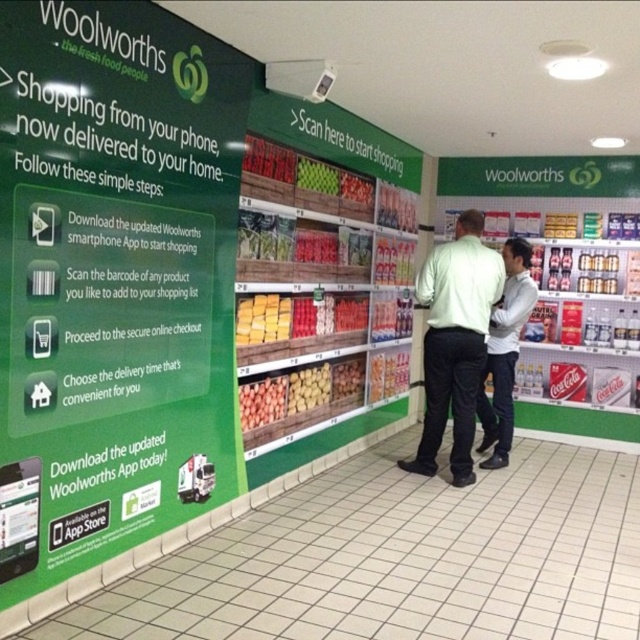
Question: Considering the relative positions of light green shirt at center and white shirt at center in the image provided, where is light green shirt at center located with respect to white shirt at center?

Choices:
 (A) left
 (B) right

Answer: (A)

Question: Can you confirm if light green shirt at center is thinner than white shirt at center?

Choices:
 (A) no
 (B) yes

Answer: (A)

Question: Is light green shirt at center thinner than white shirt at center?

Choices:
 (A) no
 (B) yes

Answer: (A)

Question: Which object is farther from the camera taking this photo?

Choices:
 (A) white shirt at center
 (B) light green shirt at center

Answer: (A)